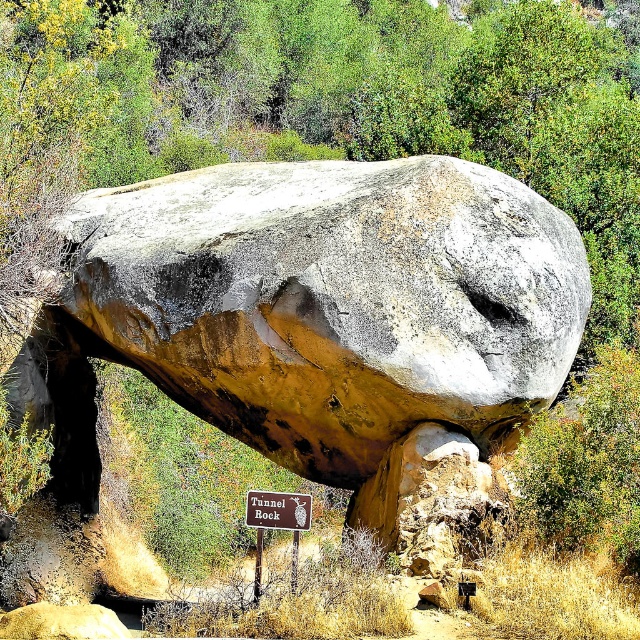
Question: Does gray/rough rock at center appear on the right side of brown wooden sign at center?

Choices:
 (A) yes
 (B) no

Answer: (B)

Question: Which of the following is the closest to the observer?

Choices:
 (A) brown wooden sign at center
 (B) gray/rough rock at center

Answer: (A)

Question: Which of the following is the farthest from the observer?

Choices:
 (A) (483, 220)
 (B) (276, 528)

Answer: (A)

Question: Which of the following is the farthest from the observer?

Choices:
 (A) gray/rough rock at center
 (B) brown wooden sign at center

Answer: (A)

Question: Is gray/rough rock at center thinner than brown wooden sign at center?

Choices:
 (A) no
 (B) yes

Answer: (A)

Question: Is gray/rough rock at center positioned in front of brown wooden sign at center?

Choices:
 (A) yes
 (B) no

Answer: (B)